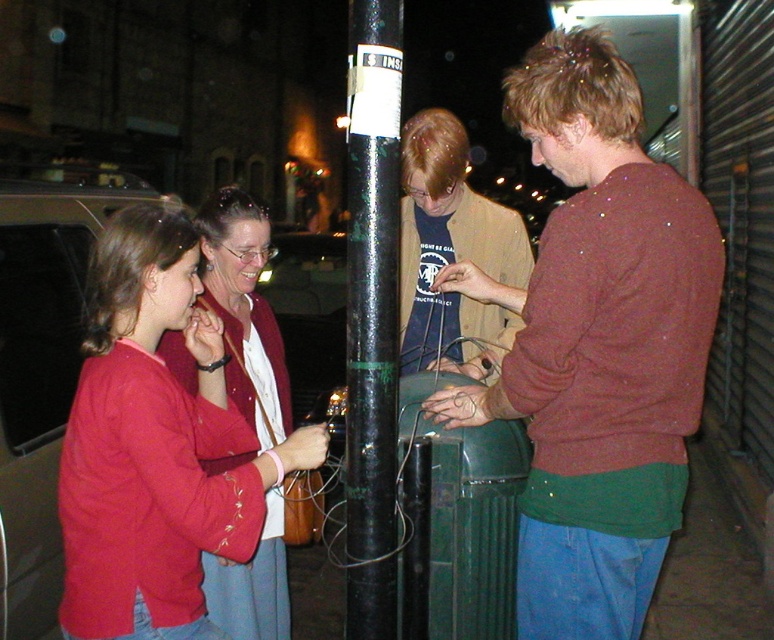
Who is lower down, black glossy pole at center or matte red sweater at left?

matte red sweater at left is lower down.

Is black glossy pole at center closer to camera compared to matte red sweater at left?

Yes.

Is point (379, 424) positioned after point (249, 420)?

No, it is in front of (249, 420).

Locate an element on the screen. The height and width of the screenshot is (640, 774). black glossy pole at center is located at coordinates (372, 314).

Is maroon sweater at center bigger than matte red sweater at left?

Indeed, maroon sweater at center has a larger size compared to matte red sweater at left.

Which is more to the right, maroon sweater at center or matte red sweater at left?

maroon sweater at center

Which is behind, point (601, 579) or point (245, 240)?

The point (245, 240) is behind.

What are the coordinates of `maroon sweater at center` in the screenshot? It's located at (598, 346).

Which is above, maroon sweater at center or black glossy pole at center?

maroon sweater at center

Does maroon sweater at center appear on the left side of black glossy pole at center?

In fact, maroon sweater at center is to the right of black glossy pole at center.

Which is in front, point (545, 154) or point (387, 616)?

Point (387, 616)

Locate an element on the screen. maroon sweater at center is located at coordinates (598, 346).